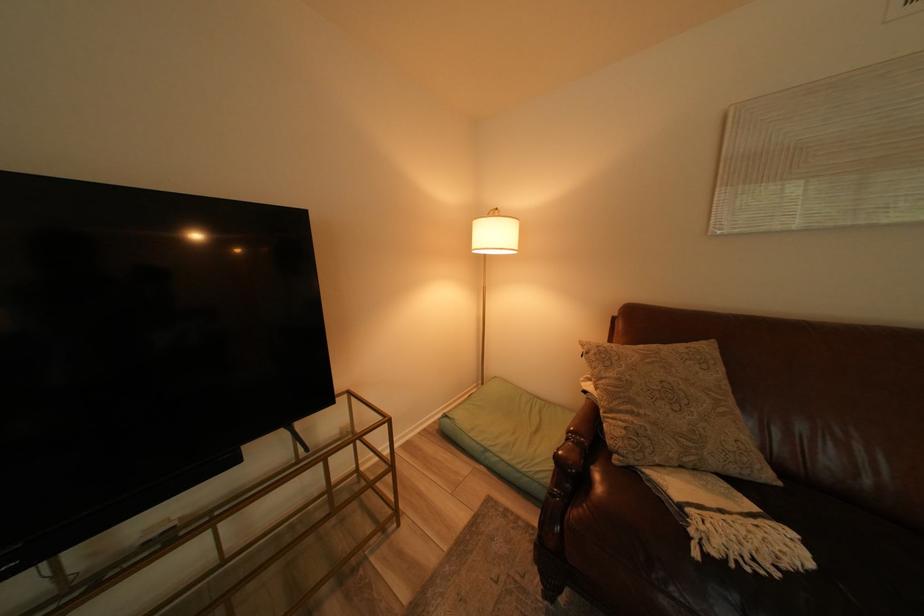
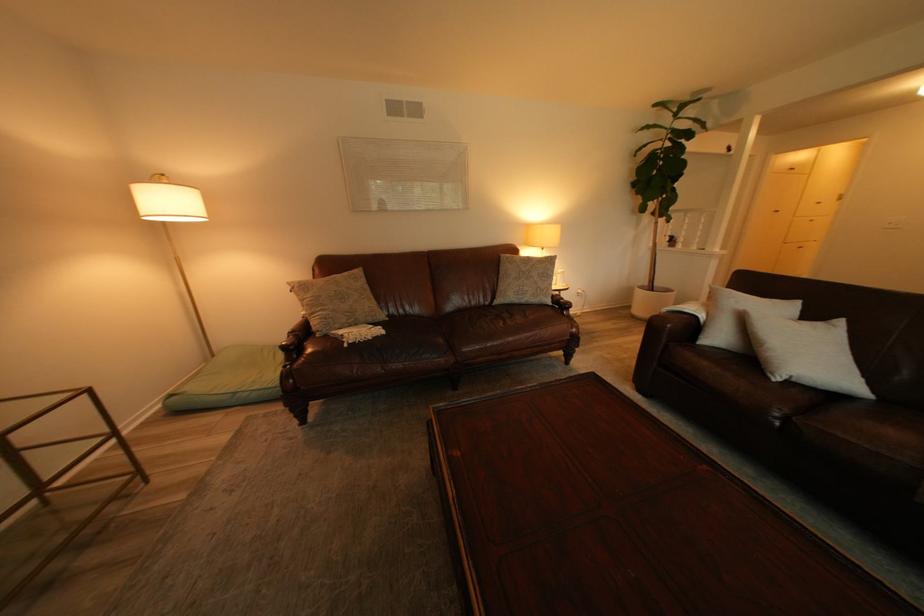
Question: How did the camera likely rotate?

Choices:
 (A) Left
 (B) Right
 (C) Up
 (D) Down

Answer: (B)